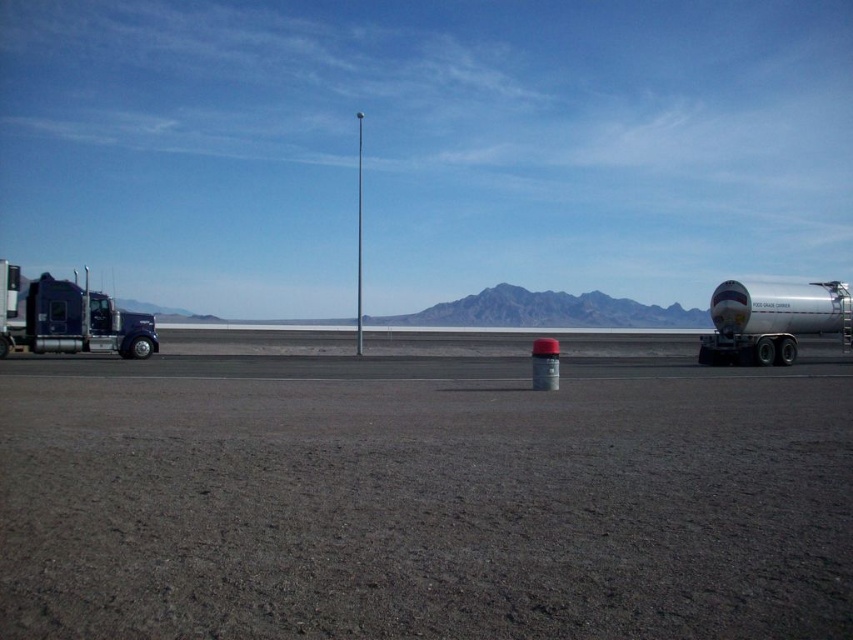
Question: Which object is farther from the camera taking this photo?

Choices:
 (A) silver metallic tanker at right
 (B) brushed metal truck at left
 (C) gray asphalt tarmac at center

Answer: (A)

Question: Does gray asphalt tarmac at center lie in front of silver metallic tanker at right?

Choices:
 (A) no
 (B) yes

Answer: (B)

Question: Can you confirm if gray asphalt tarmac at center is thinner than silver metallic tanker at right?

Choices:
 (A) yes
 (B) no

Answer: (B)

Question: Which point is farther from the camera taking this photo?

Choices:
 (A) (187, 552)
 (B) (709, 364)
 (C) (97, 314)

Answer: (B)

Question: Among these points, which one is farthest from the camera?

Choices:
 (A) coord(756,342)
 (B) coord(200,467)

Answer: (A)

Question: Does gray asphalt tarmac at center appear on the left side of brushed metal truck at left?

Choices:
 (A) no
 (B) yes

Answer: (A)